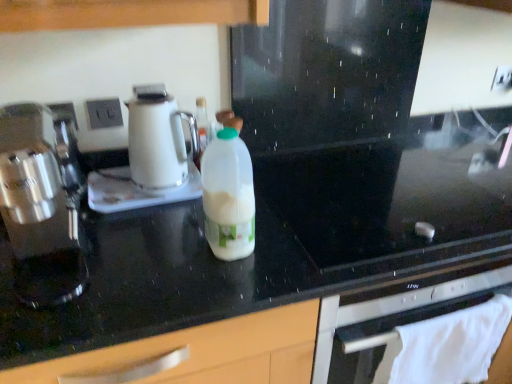
The width and height of the screenshot is (512, 384). What are the coordinates of `vacant space that is in between white plastic bottle at center and satin silver coffee maker at left, arranged as the 1th kitchen appliance when viewed from the front` in the screenshot? It's located at (151, 243).